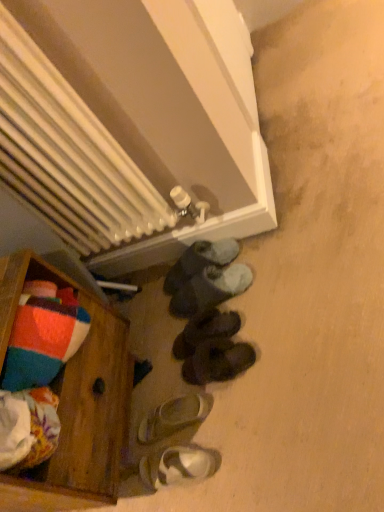
Locate an element on the screen. The image size is (384, 512). vacant area in front of black suede shoes at lower center, which is the 3th footwear from bottom to top is located at coordinates (244, 406).